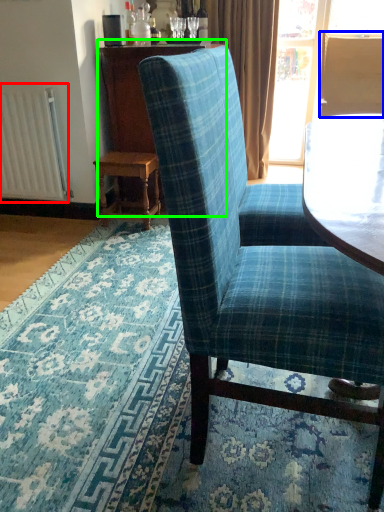
Question: Estimate the real-world distances between objects in this image. Which object is farther from radiator (highlighted by a red box), back (highlighted by a blue box) or dresser (highlighted by a green box)?

Choices:
 (A) back
 (B) dresser

Answer: (A)